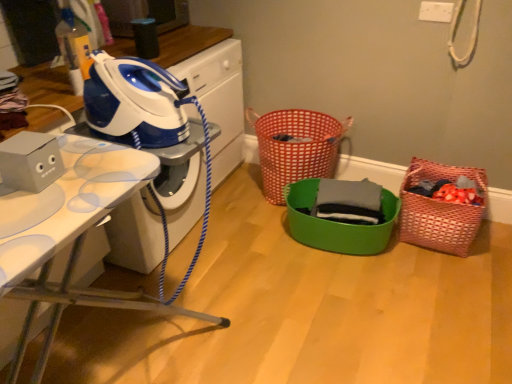
You are a GUI agent. You are given a task and a screenshot of the screen. Output one action in this format:
    pyautogui.click(x=<x>, y=<y>)
    Task: Click on the free space in front of white glossy ironing board at left
    Image resolution: width=512 pixels, height=384 pixels.
    Given the screenshot: What is the action you would take?
    pyautogui.click(x=145, y=327)